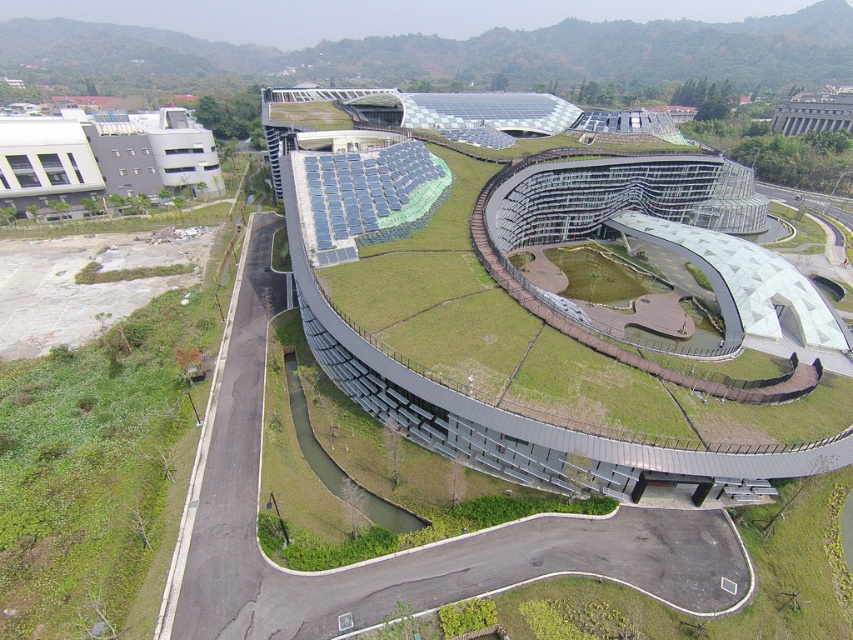
You are a drone operator tasked with delivering a package to the white matte building at upper left. The delivery zone is marked on the roof, which is 120 meters in diameter. Can your drone safely land on the roof without exceeding the designated area?

The white matte building at upper left has a delivery zone with a 120 meter diameter. Since the drone must stay within this area, and the building itself is 122.46 meters away from the operator, the drone can safely land as the distance to the building is within the operational range. However, the question about exceeding the designated area requires knowing the drone landing area size, which isn

You are a drone operator trying to capture a clear aerial shot of the green matte building at center and the metallic gray building at upper right. From your current position, which building would appear closer to you?

The green matte building at center appears closer because it is in front of the metallic gray building at upper right.